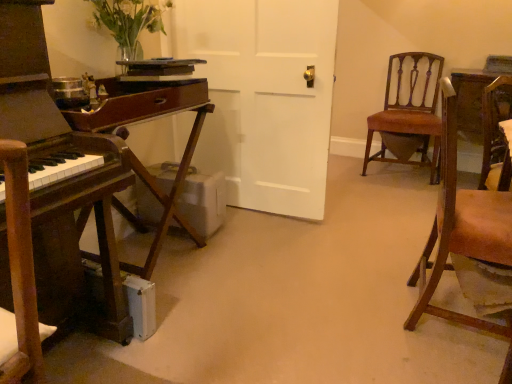
The height and width of the screenshot is (384, 512). I want to click on vacant space positioned to the left of brown leather chair at right, positioned as the 1th chair in front-to-back order, so tap(354, 315).